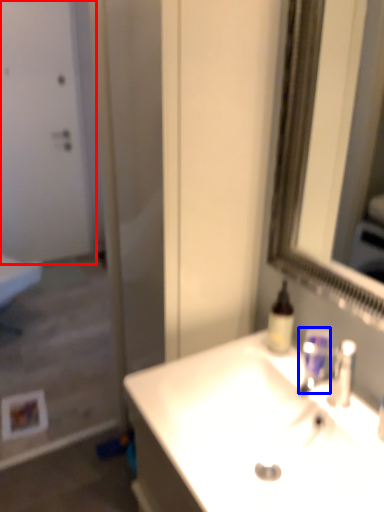
Question: Among these objects, which one is farthest to the camera, door (highlighted by a red box) or mouthwash (highlighted by a blue box)?

Choices:
 (A) door
 (B) mouthwash

Answer: (A)